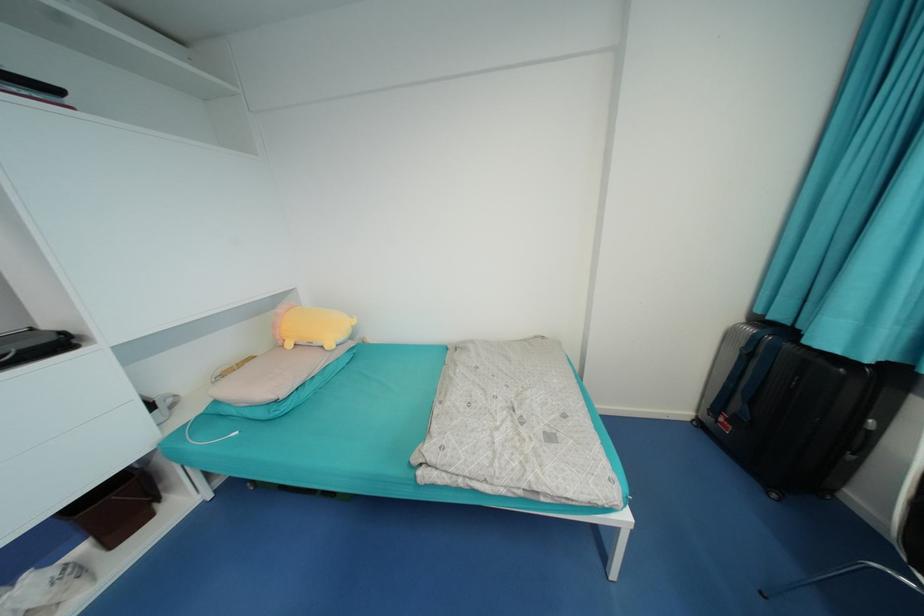
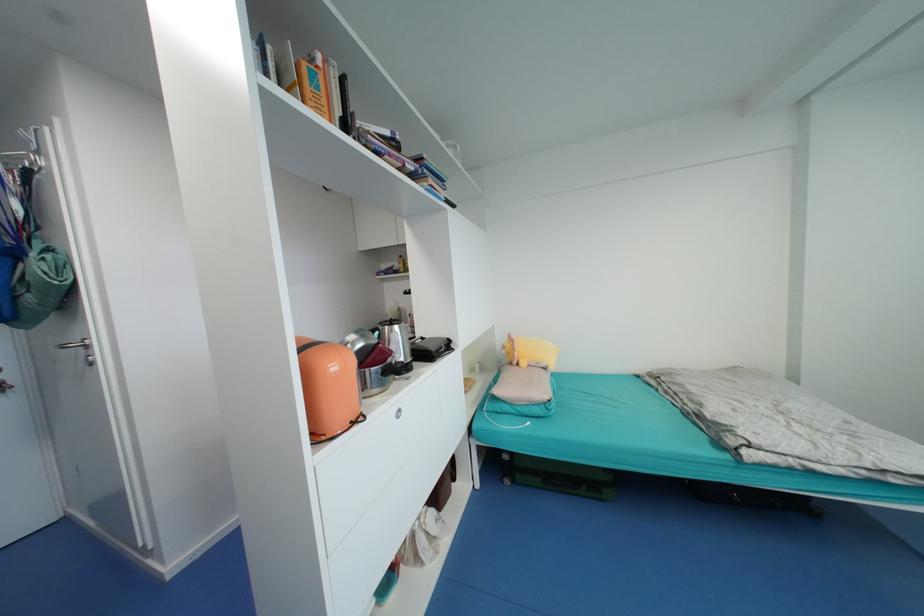
In a continuous first-person perspective shot, in which direction is the camera moving?

The cameraman walked toward left, backward.